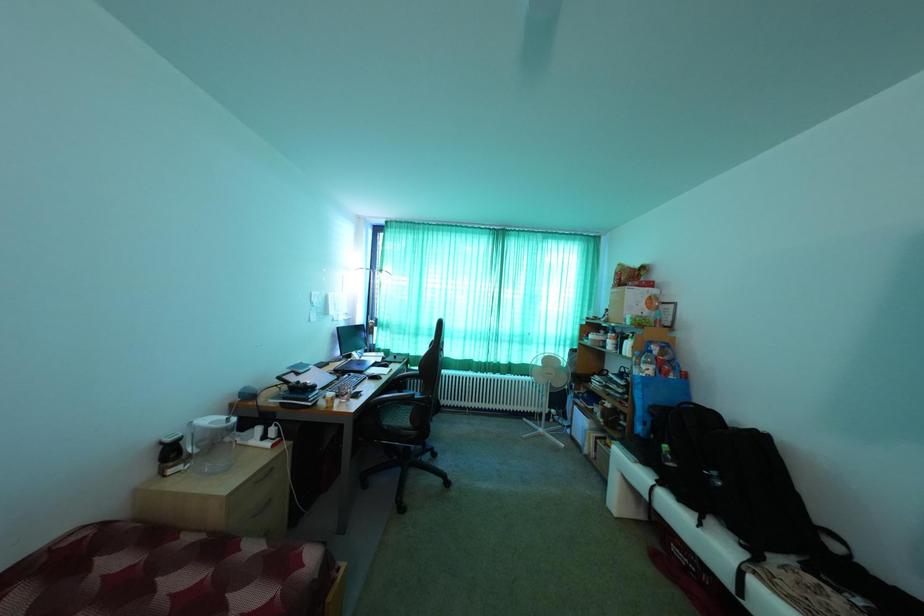
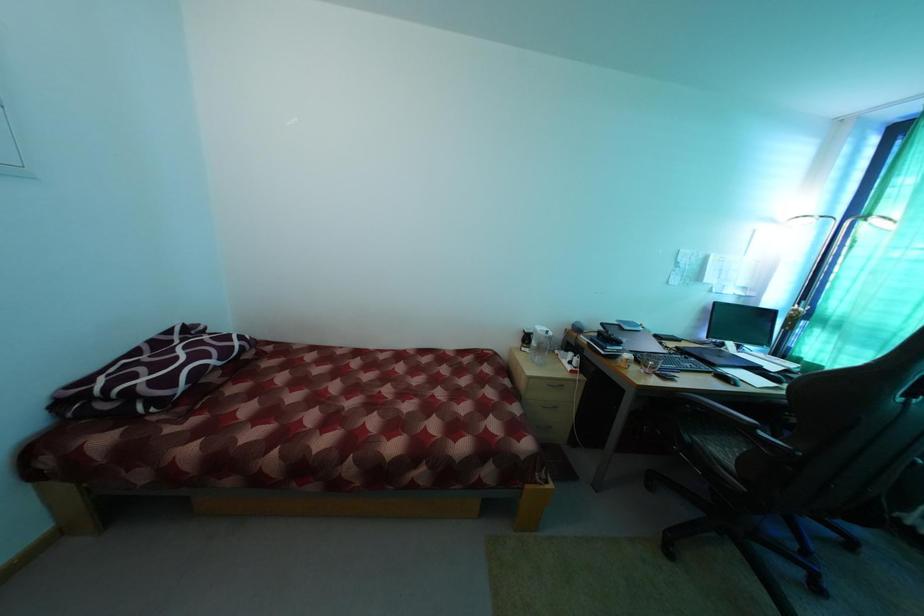
Question: How did the camera likely rotate?

Choices:
 (A) Left
 (B) Right
 (C) Up
 (D) Down

Answer: (A)